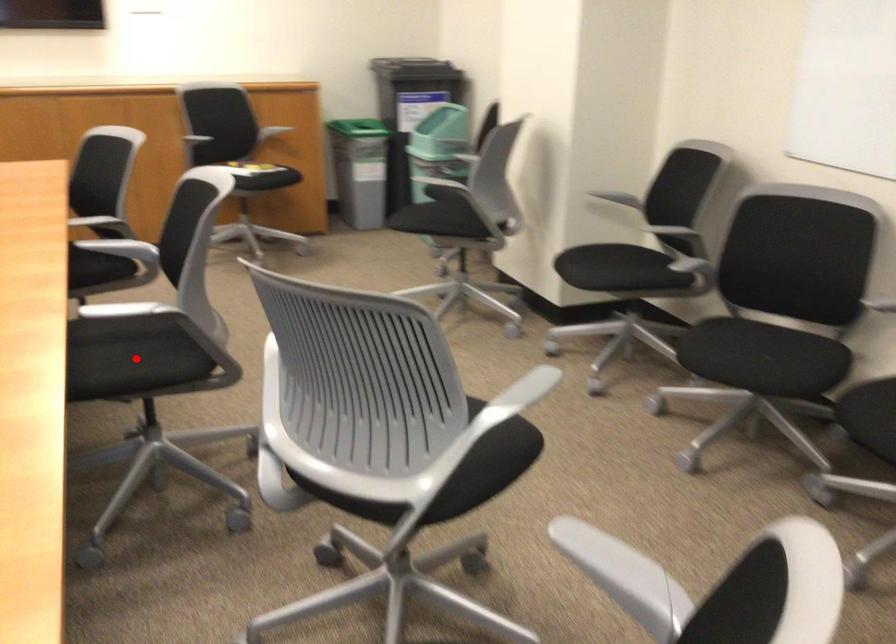
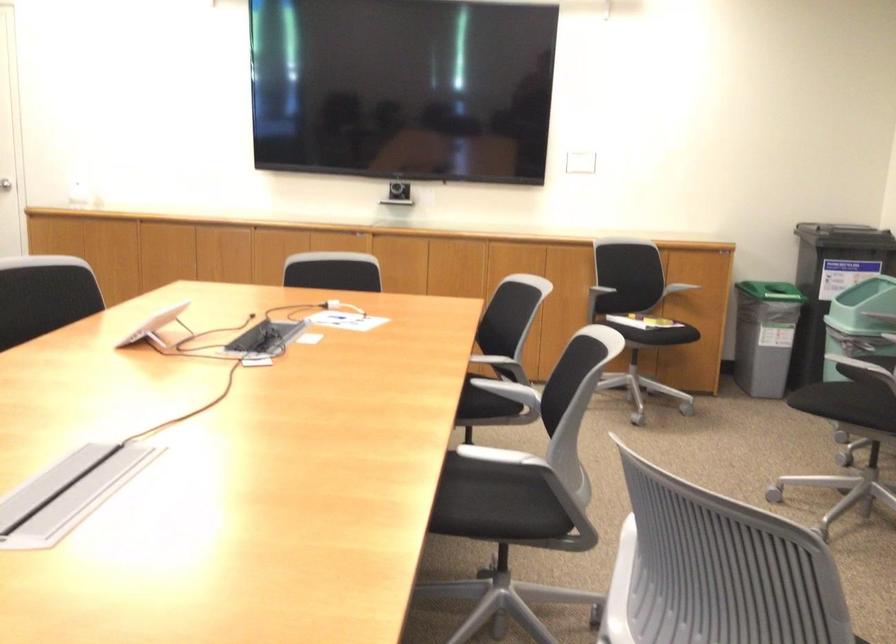
Locate, in the second image, the point that corresponds to the highlighted location in the first image.

(492, 504)